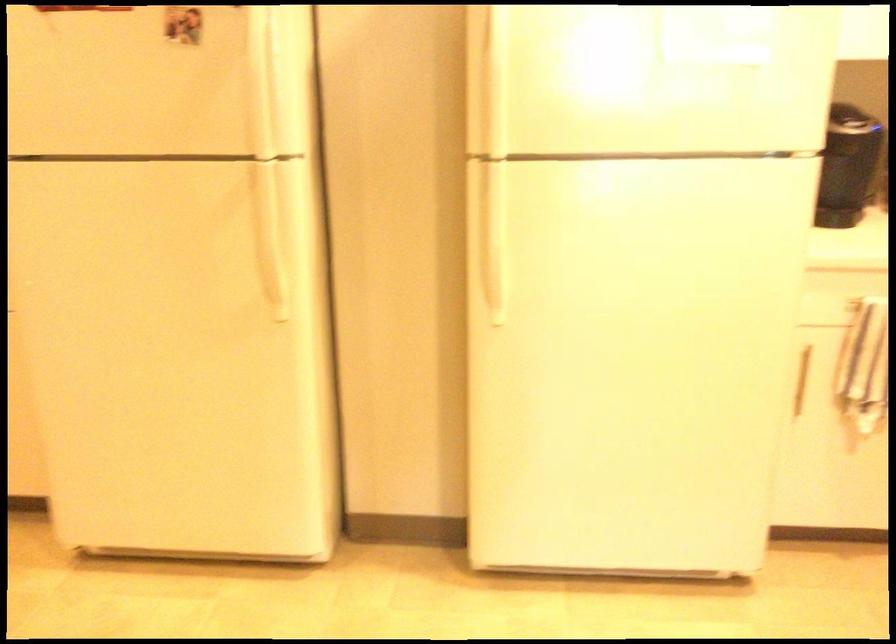
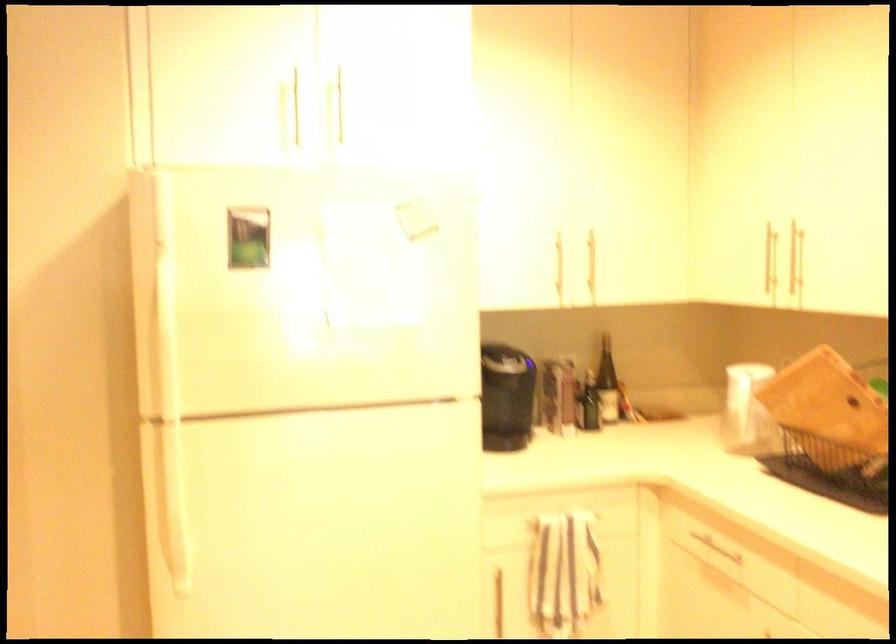
Question: Which direction would the cameraman need to move to produce the second image? Reply with the corresponding letter.

Choices:
 (A) Left
 (B) Right
 (C) Forward
 (D) Backward

Answer: (B)